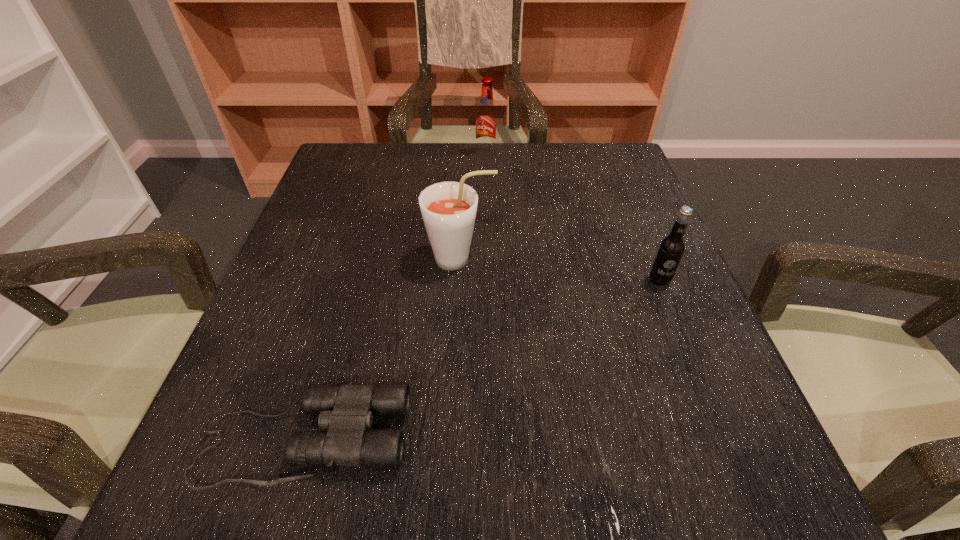
This screenshot has height=540, width=960. Find the location of `free space between the farthest object and the rightmost object`. free space between the farthest object and the rightmost object is located at coordinates (572, 218).

The image size is (960, 540). In order to click on object identified as the closest to the binoculars in this screenshot , I will do `click(449, 208)`.

Identify which object is the nearest to the shortest object. Please provide its 2D coordinates. Your answer should be formatted as a tuple, i.e. [(x, y)], where the tuple contains the x and y coordinates of a point satisfying the conditions above.

[(449, 208)]

Identify which root beer is located as the second nearest to the nearest object. Please provide its 2D coordinates. Your answer should be formatted as a tuple, i.e. [(x, y)], where the tuple contains the x and y coordinates of a point satisfying the conditions above.

[(671, 248)]

This screenshot has width=960, height=540. I want to click on root beer object that ranks as the second closest to the rightmost object, so click(486, 118).

Image resolution: width=960 pixels, height=540 pixels. Identify the location of free space that satisfies the following two spatial constraints: 1. on the front side of the farthest root beer; 2. at the eyepiece of the nearest object. (492, 438).

Where is `vacant space that satisfies the following two spatial constraints: 1. on the label of the rightmost object; 2. at the eyepiece of the shortest object`? vacant space that satisfies the following two spatial constraints: 1. on the label of the rightmost object; 2. at the eyepiece of the shortest object is located at coordinates (722, 438).

Locate an element on the screen. vacant space that satisfies the following two spatial constraints: 1. on the label of the rightmost root beer; 2. at the eyepiece of the binoculars is located at coordinates (722, 438).